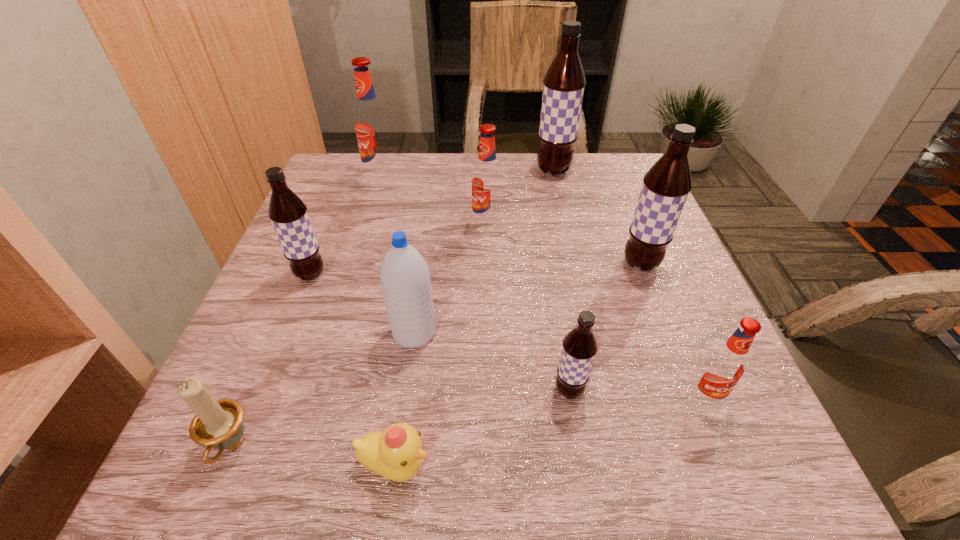
The width and height of the screenshot is (960, 540). In order to click on vacant area situated on the left of the second red root beer from right to left in this screenshot , I will do `click(450, 225)`.

Locate an element on the screen. This screenshot has width=960, height=540. free space located 0.060m on the right of the leftmost brown root beer is located at coordinates (356, 274).

This screenshot has height=540, width=960. In order to click on free space located on the right of the fifth nearest object in this screenshot , I will do `click(553, 333)`.

Where is `free space located 0.160m on the back of the nearest brown root beer`? Image resolution: width=960 pixels, height=540 pixels. free space located 0.160m on the back of the nearest brown root beer is located at coordinates (555, 305).

Locate an element on the screen. blank area located 0.320m on the back of the rightmost red root beer is located at coordinates (646, 254).

Identify the location of vacant space positioned 0.170m on the front-facing side of the shortest object. The width and height of the screenshot is (960, 540). (554, 466).

Locate an element on the screen. Image resolution: width=960 pixels, height=540 pixels. candle_holder that is positioned at the near edge is located at coordinates (217, 424).

What are the coordinates of `duckling that is positioned at the near edge` in the screenshot? It's located at (396, 453).

Image resolution: width=960 pixels, height=540 pixels. What are the coordinates of `candle_holder that is at the left edge` in the screenshot? It's located at (217, 424).

Locate an element on the screen. object that is at the far left corner is located at coordinates (371, 124).